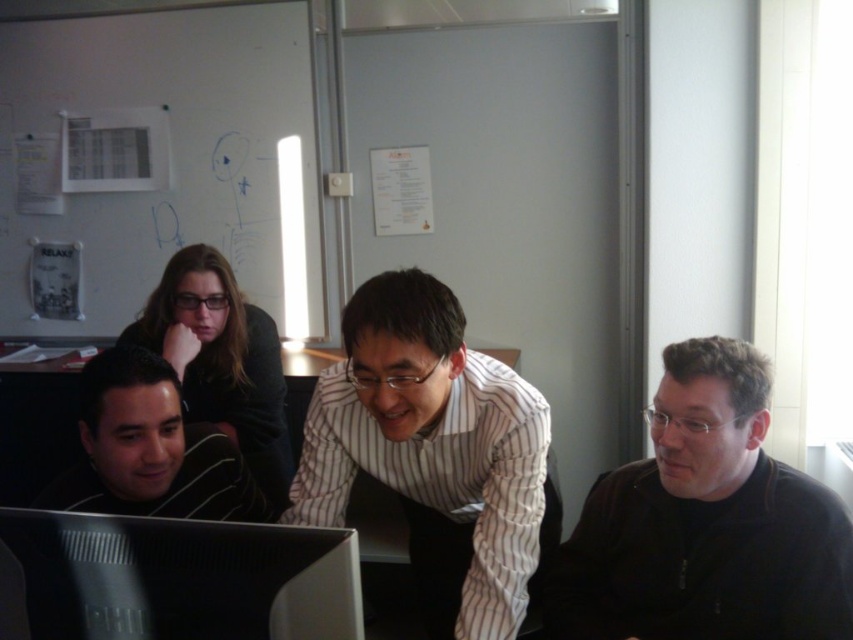
You are standing in front of the whiteboard in the office scene. There are two points marked on the whiteboard at coordinates point (734, 433) and point (456, 346). If you want to touch both points with your finger without moving your hand, which point should you touch first based on their depth?

You should touch point (734, 433) first because it is closer to you than point (456, 346), allowing you to reach it without moving your hand.

From the picture: You are organizing a photoshoot and need to arrange two people in the scene so that their clothing items are visible. Given the black matte jacket at lower right and the white striped shirt at center, which clothing item should be placed closer to the camera to make it appear larger?

The white striped shirt at center should be placed closer to the camera because it is larger than the black matte jacket at lower right, making it appear bigger when positioned nearer.

You are standing in front of the whiteboard and want to touch both points on the whiteboard. Which point should you reach for first, the point at coordinate (701, 568) or the point at coordinate (13, 512)?

You should reach for the point at coordinate (13, 512) first because it is closer to you than the point at coordinate (701, 568), which is further away.